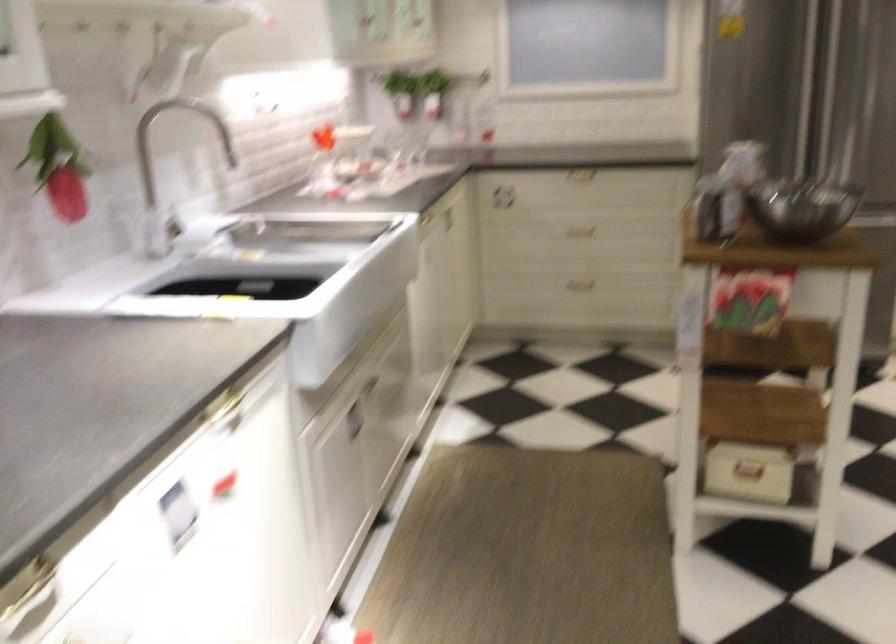
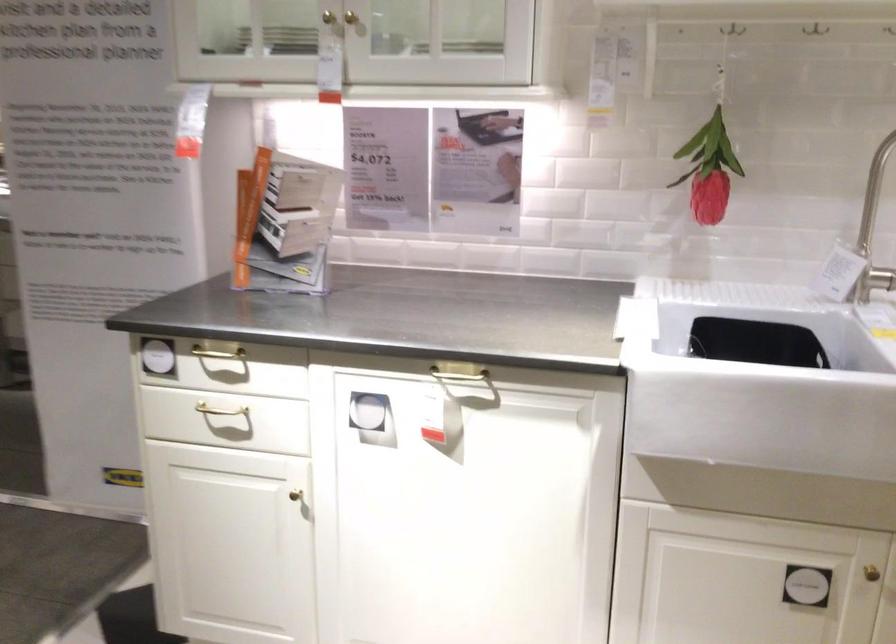
Find the pixel in the second image that matches (186,230) in the first image.

(880, 278)